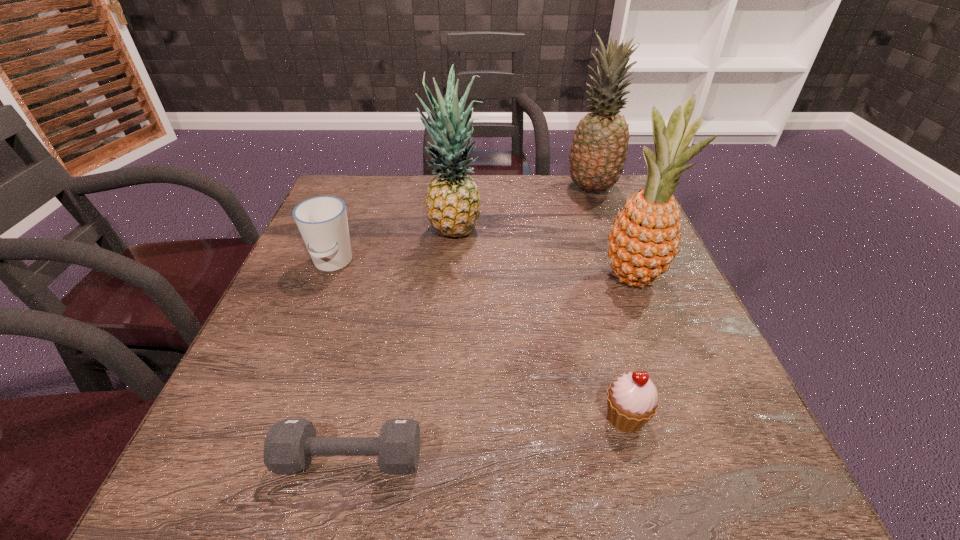
The image size is (960, 540). I want to click on the farthest pineapple, so click(599, 149).

Identify the location of the second farthest pineapple. (453, 207).

The height and width of the screenshot is (540, 960). Identify the location of the nearest pineapple. (645, 238).

Find the location of a particular element. The width and height of the screenshot is (960, 540). cup is located at coordinates (322, 221).

Locate an element on the screen. cupcake is located at coordinates (632, 399).

This screenshot has width=960, height=540. Identify the location of dumbbell. (290, 444).

Locate an element on the screen. blank space located 0.150m on the front of the farthest pineapple is located at coordinates (609, 235).

You are a GUI agent. You are given a task and a screenshot of the screen. Output one action in this format:
    pyautogui.click(x=<x>, y=<y>)
    Task: Click on the free location located on the left of the second nearest pineapple
    This screenshot has width=960, height=540.
    Given the screenshot: What is the action you would take?
    [x=312, y=233]

You are a GUI agent. You are given a task and a screenshot of the screen. Output one action in this format:
    pyautogui.click(x=<x>, y=<y>)
    Task: Click on the free location located on the front of the nearest pineapple
    The height and width of the screenshot is (540, 960).
    Given the screenshot: What is the action you would take?
    pyautogui.click(x=659, y=342)

In order to click on free point located 0.150m with a handle on the side of the fourth tallest object in this screenshot , I will do `click(304, 333)`.